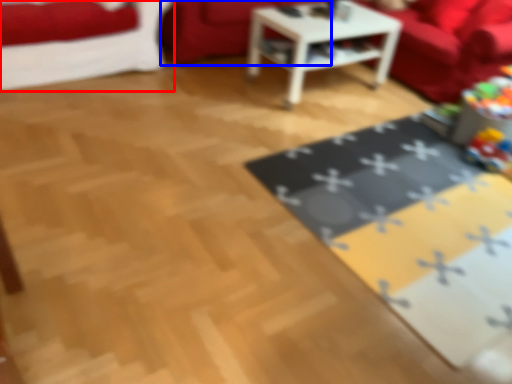
Question: Which point is closer to the camera, studio couch (highlighted by a red box) or couch (highlighted by a blue box)?

Choices:
 (A) studio couch
 (B) couch

Answer: (A)